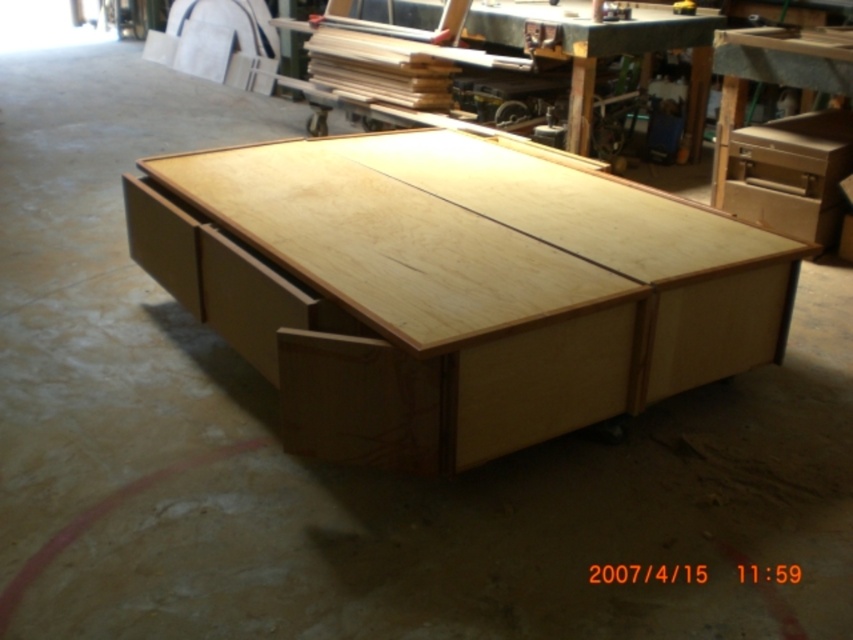
You are a carpenter who needs to place a 1.5 meter long wooden plank on the workbench. The natural wood table at center and natural wood drawer at center are both on the bench. Can the plank fit entirely on the bench between these two objects?

The natural wood table at center is 1.69 meters from the natural wood drawer at center. Since the plank is 1.5 meters long, it can fit entirely between them as the distance is greater than the plank length.

You are standing in a workshop and want to place a tool on the closest object to you. Which object should you choose between the natural wood table at center and the natural wood drawer at center?

The natural wood table at center is closer to the viewer than the natural wood drawer at center, so you should place the tool on the natural wood table at center.